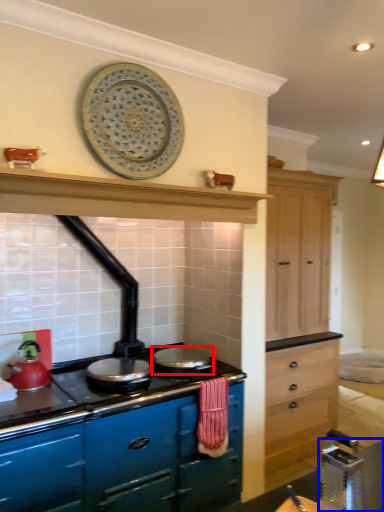
Question: Which object appears closest to the camera in this image, appliance (highlighted by a red box) or table (highlighted by a blue box)?

Choices:
 (A) appliance
 (B) table

Answer: (B)